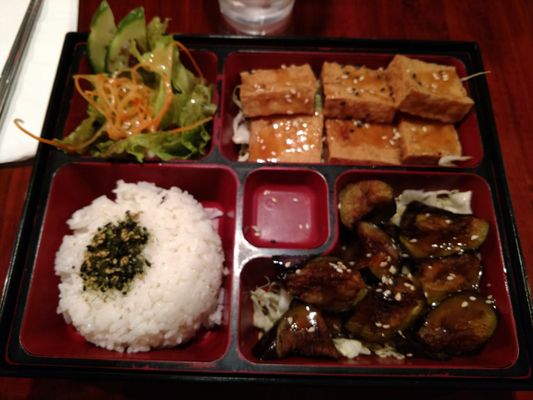
Find the location of `table`. table is located at coordinates (514, 98).